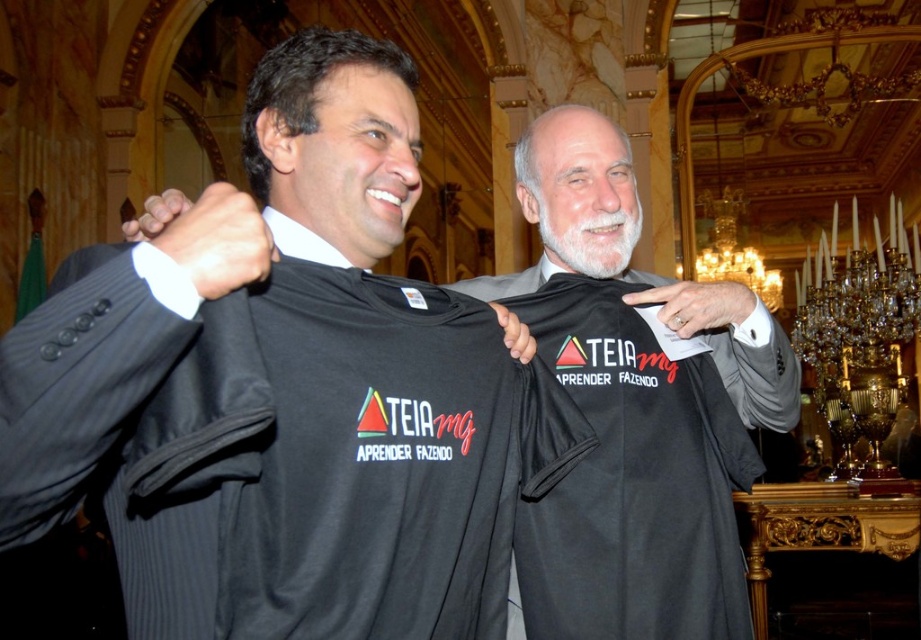
Question: Which object is closer to the camera taking this photo?

Choices:
 (A) black fabric shirt at center
 (B) black matte shirt at center

Answer: (A)

Question: Which object is closer to the camera taking this photo?

Choices:
 (A) black fabric shirt at center
 (B) black matte shirt at center

Answer: (A)

Question: Which point appears closest to the camera in this image?

Choices:
 (A) (574, 253)
 (B) (780, 340)

Answer: (B)

Question: Does black fabric shirt at center appear on the left side of black matte shirt at center?

Choices:
 (A) yes
 (B) no

Answer: (A)

Question: Where is black fabric shirt at center located in relation to black matte shirt at center in the image?

Choices:
 (A) below
 (B) above

Answer: (B)

Question: Does black fabric shirt at center come behind black matte shirt at center?

Choices:
 (A) no
 (B) yes

Answer: (A)